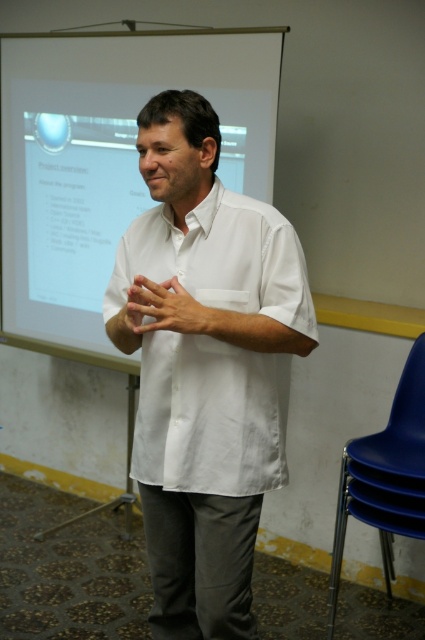
The width and height of the screenshot is (425, 640). Describe the element at coordinates (207, 371) in the screenshot. I see `white matte shirt at center` at that location.

Between white matte shirt at center and blue plastic chair at lower right, which one is positioned lower?

Positioned lower is blue plastic chair at lower right.

Locate an element on the screen. white matte shirt at center is located at coordinates (207, 371).

Can you confirm if blue plastic chair at lower right is wider than matte white hand at center?

Incorrect, blue plastic chair at lower right's width does not surpass matte white hand at center's.

The image size is (425, 640). What do you see at coordinates (385, 476) in the screenshot?
I see `blue plastic chair at lower right` at bounding box center [385, 476].

What do you see at coordinates (385, 476) in the screenshot? I see `blue plastic chair at lower right` at bounding box center [385, 476].

What are the coordinates of `blue plastic chair at lower right` in the screenshot? It's located at tap(385, 476).

Where is `white matte shirt at center`? Image resolution: width=425 pixels, height=640 pixels. white matte shirt at center is located at coordinates (207, 371).

Which is below, white matte shirt at center or white glossy projector screen at upper center?

white matte shirt at center is lower down.

Identify the location of white matte shirt at center. The image size is (425, 640). click(207, 371).